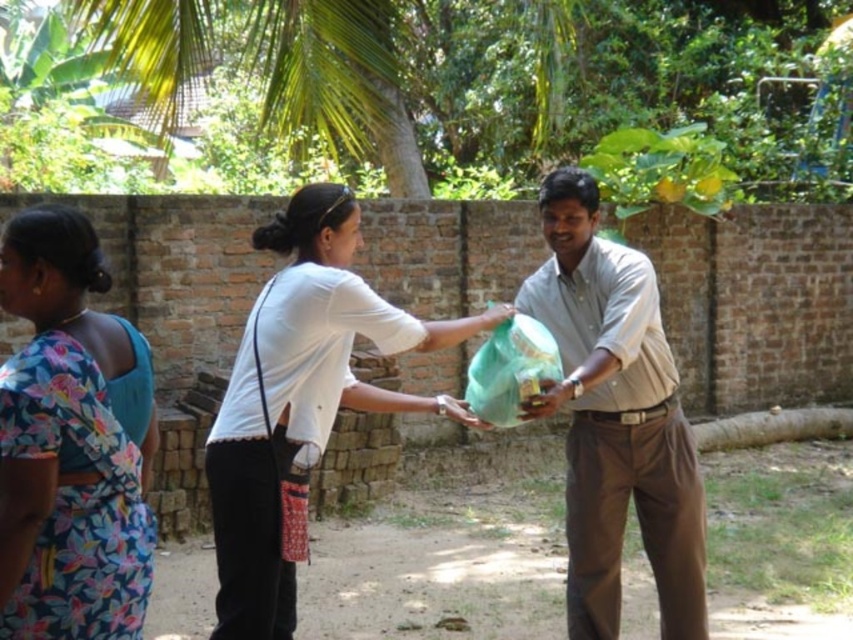
Question: From the image, what is the correct spatial relationship of white matte shirt at center in relation to matte green bag at center?

Choices:
 (A) above
 (B) below

Answer: (A)

Question: Among these points, which one is farthest from the camera?

Choices:
 (A) (448, 342)
 (B) (62, 346)

Answer: (A)

Question: Based on their relative distances, which object is farther from the matte green bag at center?

Choices:
 (A) floral fabric saree at left
 (B) white matte shirt at center

Answer: (A)

Question: Which object is the farthest from the floral fabric saree at left?

Choices:
 (A) white matte shirt at center
 (B) matte green bag at center

Answer: (B)

Question: Is floral fabric saree at left above matte green bag at center?

Choices:
 (A) yes
 (B) no

Answer: (A)

Question: Is floral fabric saree at left in front of matte green bag at center?

Choices:
 (A) no
 (B) yes

Answer: (B)